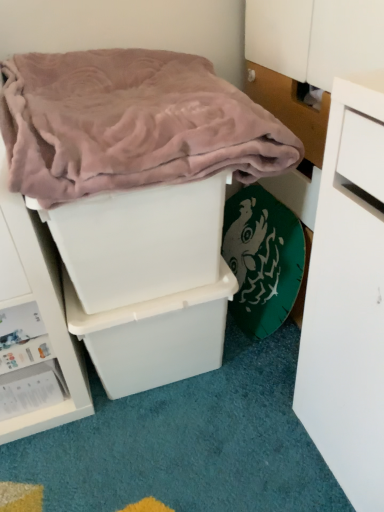
Question: From a real-world perspective, is white plastic storage box at center, which ranks as the 3th storage box in bottom-to-top order, located beneath white plastic storage box at lower left, the first storage box ordered from the bottom?

Choices:
 (A) no
 (B) yes

Answer: (A)

Question: Does white plastic storage box at center, which ranks as the 3th storage box in bottom-to-top order, have a greater height compared to white plastic storage box at lower left, the first storage box ordered from the bottom?

Choices:
 (A) no
 (B) yes

Answer: (B)

Question: Is white plastic storage box at center, placed as the 1th storage box when sorted from top to bottom, shorter than white plastic storage box at lower left, the first storage box ordered from the bottom?

Choices:
 (A) no
 (B) yes

Answer: (A)

Question: Are white plastic storage box at center, which ranks as the 3th storage box in bottom-to-top order, and white plastic storage box at lower left, acting as the 3th storage box starting from the top, far apart?

Choices:
 (A) yes
 (B) no

Answer: (B)

Question: Considering the relative positions of white plastic storage box at center, which ranks as the 3th storage box in bottom-to-top order, and white plastic storage box at lower left, the first storage box ordered from the bottom, in the image provided, is white plastic storage box at center, which ranks as the 3th storage box in bottom-to-top order, to the left of white plastic storage box at lower left, the first storage box ordered from the bottom, from the viewer's perspective?

Choices:
 (A) no
 (B) yes

Answer: (A)

Question: Considering the positions of white plastic storage box at center, placed as the 1th storage box when sorted from top to bottom, and pink plush blanket at upper left in the image, is white plastic storage box at center, placed as the 1th storage box when sorted from top to bottom, taller or shorter than pink plush blanket at upper left?

Choices:
 (A) short
 (B) tall

Answer: (B)

Question: From the image's perspective, relative to pink plush blanket at upper left, is white plastic storage box at center, placed as the 1th storage box when sorted from top to bottom, above or below?

Choices:
 (A) above
 (B) below

Answer: (B)

Question: Does point (94, 288) appear closer or farther from the camera than point (89, 158)?

Choices:
 (A) closer
 (B) farther

Answer: (B)

Question: In the image, is white plastic storage box at center, which ranks as the 3th storage box in bottom-to-top order, positioned in front of or behind pink plush blanket at upper left?

Choices:
 (A) front
 (B) behind

Answer: (B)

Question: In terms of width, does pink plush blanket at upper left look wider or thinner when compared to white plastic storage box at center, placed as the 2th storage box when sorted from top to bottom?

Choices:
 (A) wide
 (B) thin

Answer: (A)

Question: Is pink plush blanket at upper left taller or shorter than white plastic storage box at center, marked as the 2th storage box in a bottom-to-top arrangement?

Choices:
 (A) short
 (B) tall

Answer: (A)

Question: From the image's perspective, is pink plush blanket at upper left located above or below white plastic storage box at center, placed as the 2th storage box when sorted from top to bottom?

Choices:
 (A) below
 (B) above

Answer: (B)

Question: Visually, is pink plush blanket at upper left positioned to the left or to the right of white plastic storage box at center, placed as the 2th storage box when sorted from top to bottom?

Choices:
 (A) right
 (B) left

Answer: (A)

Question: Considering the positions of point (9, 143) and point (99, 248), is point (9, 143) closer or farther from the camera than point (99, 248)?

Choices:
 (A) farther
 (B) closer

Answer: (B)

Question: In terms of size, does pink plush blanket at upper left appear bigger or smaller than white plastic storage box at center, placed as the 1th storage box when sorted from top to bottom?

Choices:
 (A) big
 (B) small

Answer: (A)